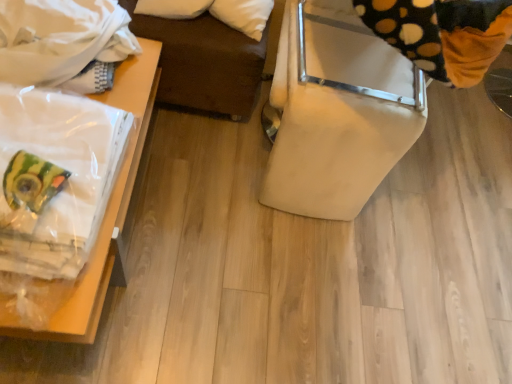
Where is `black dotted fabric at upper right`? This screenshot has height=384, width=512. black dotted fabric at upper right is located at coordinates (442, 34).

In the scene shown: How much space does clear plastic bag at left, arranged as the first furniture when viewed from the left, occupy vertically?

The height of clear plastic bag at left, arranged as the first furniture when viewed from the left, is 15.55 inches.

What do you see at coordinates (84, 282) in the screenshot? I see `clear plastic bag at left, arranged as the first furniture when viewed from the left` at bounding box center [84, 282].

At what (x,y) coordinates should I click in order to perform the action: click on black dotted fabric at upper right. Please return your answer as a coordinate pair (x, y). Looking at the image, I should click on (442, 34).

In the scene shown: Can you tell me how much white cotton blanket at upper left and black dotted fabric at upper right differ in facing direction?

0.489 degrees.

Which is behind, white cotton blanket at upper left or black dotted fabric at upper right?

white cotton blanket at upper left is behind.

Between white cotton blanket at upper left and black dotted fabric at upper right, which one has less height?

Standing shorter between the two is white cotton blanket at upper left.

Considering the points (100, 10) and (479, 49), which point is in front, point (100, 10) or point (479, 49)?

The point (479, 49) is in front.

Is clear plastic bag at left, arranged as the first furniture when viewed from the left, inside or outside of white cotton blanket at upper left?

clear plastic bag at left, arranged as the first furniture when viewed from the left, is outside white cotton blanket at upper left.

Could you tell me if clear plastic bag at left, placed as the 2th furniture when sorted from right to left, is facing white cotton blanket at upper left?

No, clear plastic bag at left, placed as the 2th furniture when sorted from right to left, does not turn towards white cotton blanket at upper left.

From the picture: From a real-world perspective, is clear plastic bag at left, placed as the 2th furniture when sorted from right to left, located higher than white cotton blanket at upper left?

No, from a real-world perspective, clear plastic bag at left, placed as the 2th furniture when sorted from right to left, is not above white cotton blanket at upper left.

Considering the relative sizes of clear plastic bag at left, arranged as the first furniture when viewed from the left, and white cotton blanket at upper left in the image provided, is clear plastic bag at left, arranged as the first furniture when viewed from the left, thinner than white cotton blanket at upper left?

In fact, clear plastic bag at left, arranged as the first furniture when viewed from the left, might be wider than white cotton blanket at upper left.

How different are the orientations of white cotton blanket at upper left and clear plastic bag at left, placed as the 2th furniture when sorted from right to left, in degrees?

The facing directions of white cotton blanket at upper left and clear plastic bag at left, placed as the 2th furniture when sorted from right to left, are 0.489 degrees apart.

Which of these two, white cotton blanket at upper left or clear plastic bag at left, arranged as the first furniture when viewed from the left, is smaller?

Smaller between the two is white cotton blanket at upper left.

Is white cotton blanket at upper left turned away from clear plastic bag at left, arranged as the first furniture when viewed from the left?

white cotton blanket at upper left does not have its back to clear plastic bag at left, arranged as the first furniture when viewed from the left.

Considering the points (87, 85) and (140, 78), which point is behind, point (87, 85) or point (140, 78)?

Positioned behind is point (140, 78).

Is beige fabric chair at right, which is counted as the second furniture, starting from the left, completely or partially inside black dotted fabric at upper right?

No, beige fabric chair at right, which is counted as the second furniture, starting from the left, is not a part of black dotted fabric at upper right.

Which of these two, black dotted fabric at upper right or beige fabric chair at right, positioned as the 1th furniture in right-to-left order, stands taller?

beige fabric chair at right, positioned as the 1th furniture in right-to-left order.

From the picture: Which of these two, black dotted fabric at upper right or beige fabric chair at right, which is counted as the second furniture, starting from the left, is thinner?

With smaller width is black dotted fabric at upper right.

From a real-world perspective, who is located higher, black dotted fabric at upper right or clear plastic bag at left, arranged as the first furniture when viewed from the left?

In real-world perspective, black dotted fabric at upper right is above.

Would you consider black dotted fabric at upper right to be distant from clear plastic bag at left, placed as the 2th furniture when sorted from right to left?

That's not correct — black dotted fabric at upper right is a little close to clear plastic bag at left, placed as the 2th furniture when sorted from right to left.

From the picture: Does black dotted fabric at upper right have a lesser height compared to clear plastic bag at left, placed as the 2th furniture when sorted from right to left?

Yes, black dotted fabric at upper right is shorter than clear plastic bag at left, placed as the 2th furniture when sorted from right to left.

From the image's perspective, who appears lower, black dotted fabric at upper right or clear plastic bag at left, arranged as the first furniture when viewed from the left?

clear plastic bag at left, arranged as the first furniture when viewed from the left, is shown below in the image.

Is black dotted fabric at upper right smaller than white cotton blanket at upper left?

No.

Based on their positions, is black dotted fabric at upper right located to the left or right of white cotton blanket at upper left?

Based on their positions, black dotted fabric at upper right is located to the right of white cotton blanket at upper left.

Is black dotted fabric at upper right aimed at white cotton blanket at upper left?

No, black dotted fabric at upper right is not turned towards white cotton blanket at upper left.

Considering the sizes of objects black dotted fabric at upper right and white cotton blanket at upper left in the image provided, who is shorter, black dotted fabric at upper right or white cotton blanket at upper left?

white cotton blanket at upper left.

Can you confirm if beige fabric chair at right, which is counted as the second furniture, starting from the left, is positioned to the right of white cotton blanket at upper left?

Yes.

In the scene shown: Is beige fabric chair at right, positioned as the 1th furniture in right-to-left order, turned away from white cotton blanket at upper left?

No, white cotton blanket at upper left is not at the back of beige fabric chair at right, positioned as the 1th furniture in right-to-left order.

Is beige fabric chair at right, which is counted as the second furniture, starting from the left, bigger or smaller than white cotton blanket at upper left?

beige fabric chair at right, which is counted as the second furniture, starting from the left, is bigger than white cotton blanket at upper left.

From a real-world perspective, which furniture is the 1st one underneath the white cotton blanket at upper left? Please provide its 2D coordinates.

[(336, 112)]

Where is `blanket to the left of black dotted fabric at upper right`? blanket to the left of black dotted fabric at upper right is located at coordinates (61, 39).

Starting from the white cotton blanket at upper left, which furniture is the 1st one to the right? Please provide its 2D coordinates.

[(84, 282)]

Looking at the image, which one is located closer to clear plastic bag at left, placed as the 2th furniture when sorted from right to left, black dotted fabric at upper right or white cotton blanket at upper left?

white cotton blanket at upper left lies closer to clear plastic bag at left, placed as the 2th furniture when sorted from right to left, than the other object.

Considering their positions, is beige fabric chair at right, which is counted as the second furniture, starting from the left, positioned closer to white cotton blanket at upper left than clear plastic bag at left, placed as the 2th furniture when sorted from right to left?

Based on the image, clear plastic bag at left, placed as the 2th furniture when sorted from right to left, appears to be nearer to white cotton blanket at upper left.

Based on their spatial positions, is white cotton blanket at upper left or clear plastic bag at left, arranged as the first furniture when viewed from the left, further from beige fabric chair at right, which is counted as the second furniture, starting from the left?

white cotton blanket at upper left is positioned further to the anchor beige fabric chair at right, which is counted as the second furniture, starting from the left.

When comparing their distances from white cotton blanket at upper left, does black dotted fabric at upper right or clear plastic bag at left, arranged as the first furniture when viewed from the left, seem closer?

The object closer to white cotton blanket at upper left is clear plastic bag at left, arranged as the first furniture when viewed from the left.

Based on their spatial positions, is clear plastic bag at left, arranged as the first furniture when viewed from the left, or black dotted fabric at upper right further from beige fabric chair at right, which is counted as the second furniture, starting from the left?

clear plastic bag at left, arranged as the first furniture when viewed from the left, lies further to beige fabric chair at right, which is counted as the second furniture, starting from the left, than the other object.

Based on their spatial positions, is white cotton blanket at upper left or beige fabric chair at right, which is counted as the second furniture, starting from the left, further from black dotted fabric at upper right?

white cotton blanket at upper left.

Considering their positions, is white cotton blanket at upper left positioned closer to clear plastic bag at left, placed as the 2th furniture when sorted from right to left, than black dotted fabric at upper right?

Based on the image, white cotton blanket at upper left appears to be nearer to clear plastic bag at left, placed as the 2th furniture when sorted from right to left.

Considering their positions, is clear plastic bag at left, placed as the 2th furniture when sorted from right to left, positioned further to black dotted fabric at upper right than beige fabric chair at right, positioned as the 1th furniture in right-to-left order?

clear plastic bag at left, placed as the 2th furniture when sorted from right to left, is further to black dotted fabric at upper right.

The width and height of the screenshot is (512, 384). What are the coordinates of `furniture between clear plastic bag at left, placed as the 2th furniture when sorted from right to left, and black dotted fabric at upper right` in the screenshot? It's located at (336, 112).

This screenshot has width=512, height=384. Identify the location of furniture between white cotton blanket at upper left and beige fabric chair at right, positioned as the 1th furniture in right-to-left order, in the horizontal direction. pos(84,282).